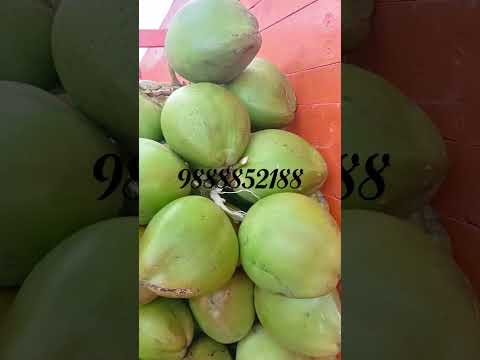
Locate an element on the screen. Image resolution: width=480 pixels, height=360 pixels. red wall is located at coordinates (315, 45).